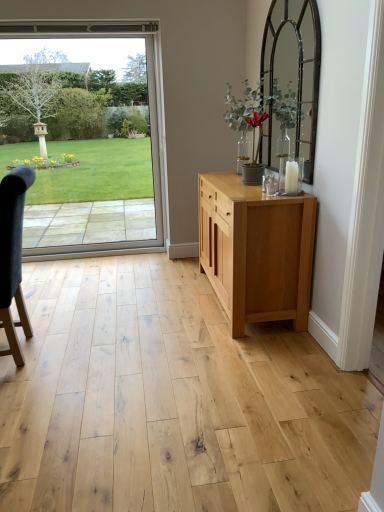
Question: From their relative heights in the image, would you say natural wood cabinet at center is taller or shorter than dark gray fabric chair at left?

Choices:
 (A) tall
 (B) short

Answer: (B)

Question: From the image's perspective, is natural wood cabinet at center located above or below dark gray fabric chair at left?

Choices:
 (A) below
 (B) above

Answer: (B)

Question: Which object is the closest to the dark gray fabric chair at left?

Choices:
 (A) natural wood cabinet at center
 (B) clear glass door at left

Answer: (A)

Question: Estimate the real-world distances between objects in this image. Which object is closer to the dark gray fabric chair at left?

Choices:
 (A) clear glass door at left
 (B) natural wood cabinet at center

Answer: (B)